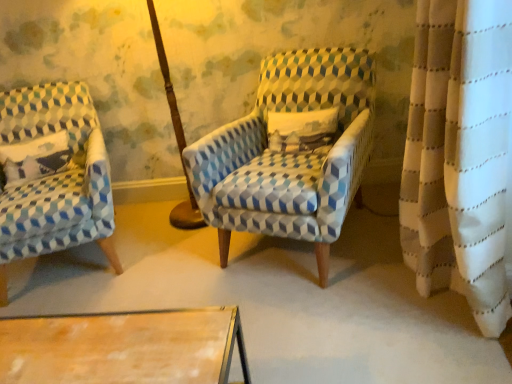
The image size is (512, 384). What are the coordinates of `blue and white geometric-patterned armchair at left, positioned as the second chair in right-to-left order` in the screenshot? It's located at (54, 182).

This screenshot has width=512, height=384. Describe the element at coordinates (54, 182) in the screenshot. I see `blue and white geometric-patterned armchair at left, arranged as the first chair when viewed from the left` at that location.

This screenshot has width=512, height=384. I want to click on blue and white patterned armchair at center, the first chair from the right, so click(289, 152).

Find the location of a particular element. The width and height of the screenshot is (512, 384). blue and white geometric-patterned armchair at left, arranged as the first chair when viewed from the left is located at coordinates (x=54, y=182).

Does blue and white patterned armchair at center, the second chair from the left, turn towards white cotton pillow at left?

No, blue and white patterned armchair at center, the second chair from the left, is not facing towards white cotton pillow at left.

Is blue and white patterned armchair at center, the first chair from the right, taller or shorter than white cotton pillow at left?

In the image, blue and white patterned armchair at center, the first chair from the right, appears to be taller than white cotton pillow at left.

Which point is more distant from viewer, [333,144] or [56,172]?

The point [56,172] is farther from the camera.

Considering the positions of objects blue and white patterned armchair at center, the second chair from the left, and white cotton pillow at left in the image provided, who is behind, blue and white patterned armchair at center, the second chair from the left, or white cotton pillow at left?

white cotton pillow at left is behind.

Can you confirm if blue and white geometric-patterned armchair at left, arranged as the first chair when viewed from the left, is bigger than blue and white patterned armchair at center, the first chair from the right?

Correct, blue and white geometric-patterned armchair at left, arranged as the first chair when viewed from the left, is larger in size than blue and white patterned armchair at center, the first chair from the right.

Could you tell me if blue and white geometric-patterned armchair at left, arranged as the first chair when viewed from the left, is turned towards blue and white patterned armchair at center, the first chair from the right?

No, blue and white geometric-patterned armchair at left, arranged as the first chair when viewed from the left, does not turn towards blue and white patterned armchair at center, the first chair from the right.

Does blue and white geometric-patterned armchair at left, arranged as the first chair when viewed from the left, come in front of blue and white patterned armchair at center, the second chair from the left?

No, the depth of blue and white geometric-patterned armchair at left, arranged as the first chair when viewed from the left, is greater than that of blue and white patterned armchair at center, the second chair from the left.

Would you say blue and white patterned armchair at center, the first chair from the right, is part of blue and white geometric-patterned armchair at left, positioned as the second chair in right-to-left order,'s contents?

No, blue and white patterned armchair at center, the first chair from the right, is not surrounded by blue and white geometric-patterned armchair at left, positioned as the second chair in right-to-left order.

Is blue and white patterned armchair at center, the first chair from the right, taller or shorter than blue and white geometric-patterned armchair at left, positioned as the second chair in right-to-left order?

Clearly, blue and white patterned armchair at center, the first chair from the right, is shorter compared to blue and white geometric-patterned armchair at left, positioned as the second chair in right-to-left order.

Is blue and white patterned armchair at center, the second chair from the left, turned away from blue and white geometric-patterned armchair at left, positioned as the second chair in right-to-left order?

No, blue and white patterned armchair at center, the second chair from the left, is not facing away from blue and white geometric-patterned armchair at left, positioned as the second chair in right-to-left order.

Can you confirm if blue and white patterned armchair at center, the second chair from the left, is smaller than blue and white geometric-patterned armchair at left, positioned as the second chair in right-to-left order?

Indeed, blue and white patterned armchair at center, the second chair from the left, has a smaller size compared to blue and white geometric-patterned armchair at left, positioned as the second chair in right-to-left order.

Is the depth of white cotton pillow at left less than that of blue and white geometric-patterned armchair at left, arranged as the first chair when viewed from the left?

No, the depth of white cotton pillow at left is greater than that of blue and white geometric-patterned armchair at left, arranged as the first chair when viewed from the left.

Which is correct: white cotton pillow at left is inside blue and white geometric-patterned armchair at left, arranged as the first chair when viewed from the left, or outside of it?

white cotton pillow at left exists entirely within blue and white geometric-patterned armchair at left, arranged as the first chair when viewed from the left.

Between white cotton pillow at left and blue and white geometric-patterned armchair at left, positioned as the second chair in right-to-left order, which one appears on the right side from the viewer's perspective?

Positioned to the right is blue and white geometric-patterned armchair at left, positioned as the second chair in right-to-left order.

From the picture: Which of these two, blue and white geometric-patterned armchair at left, positioned as the second chair in right-to-left order, or white cotton pillow at left, is smaller?

white cotton pillow at left is smaller.

Is blue and white geometric-patterned armchair at left, arranged as the first chair when viewed from the left, not within white cotton pillow at left?

blue and white geometric-patterned armchair at left, arranged as the first chair when viewed from the left, is positioned outside white cotton pillow at left.

Identify the location of the 1st chair counting from the right side of the white cotton pillow at left. (54, 182).

From a real-world perspective, which object stands above the other?

white cotton pillow at left is physically above.

Image resolution: width=512 pixels, height=384 pixels. I want to click on the 2nd chair in front of the white cotton pillow at left, starting your count from the anchor, so click(x=289, y=152).

Is white cotton pillow at left to the right of blue and white patterned armchair at center, the second chair from the left, from the viewer's perspective?

Incorrect, white cotton pillow at left is not on the right side of blue and white patterned armchair at center, the second chair from the left.

Is blue and white patterned armchair at center, the second chair from the left, at the back of white cotton pillow at left?

No, white cotton pillow at left is not facing the opposite direction of blue and white patterned armchair at center, the second chair from the left.

Measure the distance from white cotton pillow at left to blue and white patterned armchair at center, the first chair from the right.

white cotton pillow at left and blue and white patterned armchair at center, the first chair from the right, are 1.13 meters apart from each other.

The image size is (512, 384). Find the location of `chair that is the 1st object directly below the white cotton pillow at left (from a real-world perspective)`. chair that is the 1st object directly below the white cotton pillow at left (from a real-world perspective) is located at coordinates (289, 152).

Image resolution: width=512 pixels, height=384 pixels. In the image, there is a blue and white geometric-patterned armchair at left, positioned as the second chair in right-to-left order. What are the coordinates of `chair above it (from the image's perspective)` in the screenshot? It's located at (289, 152).

From the image, which object appears to be farther from white cotton pillow at left, blue and white patterned armchair at center, the second chair from the left, or blue and white geometric-patterned armchair at left, arranged as the first chair when viewed from the left?

blue and white patterned armchair at center, the second chair from the left.

Which object lies further to the anchor point blue and white patterned armchair at center, the first chair from the right, white cotton pillow at left or blue and white geometric-patterned armchair at left, positioned as the second chair in right-to-left order?

white cotton pillow at left is positioned further to the anchor blue and white patterned armchair at center, the first chair from the right.

Looking at this image, which object lies further to the anchor point blue and white patterned armchair at center, the first chair from the right, blue and white geometric-patterned armchair at left, positioned as the second chair in right-to-left order, or white cotton pillow at left?

white cotton pillow at left.

Considering their positions, is white cotton pillow at left positioned further to blue and white geometric-patterned armchair at left, arranged as the first chair when viewed from the left, than blue and white patterned armchair at center, the second chair from the left?

The object further to blue and white geometric-patterned armchair at left, arranged as the first chair when viewed from the left, is blue and white patterned armchair at center, the second chair from the left.

Looking at the image, which one is located further to blue and white geometric-patterned armchair at left, positioned as the second chair in right-to-left order, blue and white patterned armchair at center, the second chair from the left, or white cotton pillow at left?

blue and white patterned armchair at center, the second chair from the left, is further to blue and white geometric-patterned armchair at left, positioned as the second chair in right-to-left order.

Considering their positions, is blue and white geometric-patterned armchair at left, arranged as the first chair when viewed from the left, positioned further to white cotton pillow at left than blue and white patterned armchair at center, the first chair from the right?

blue and white patterned armchair at center, the first chair from the right, is positioned further to the anchor white cotton pillow at left.

You are a GUI agent. You are given a task and a screenshot of the screen. Output one action in this format:
    pyautogui.click(x=<x>, y=<y>)
    Task: Click on the chair between white cotton pillow at left and blue and white patterned armchair at center, the second chair from the left
    
    Given the screenshot: What is the action you would take?
    pyautogui.click(x=54, y=182)